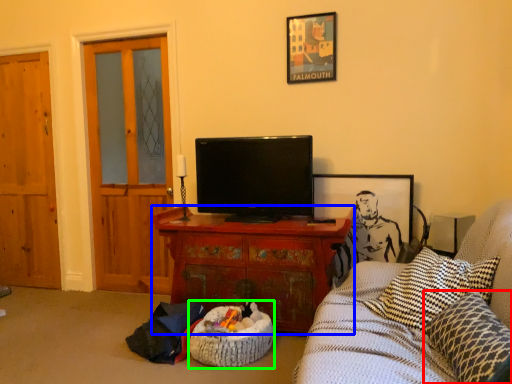
Question: Based on their relative distances, which object is nearer to pillow (highlighted by a red box)? Choose from cabinetry (highlighted by a blue box) and infant bed (highlighted by a green box).

Choices:
 (A) cabinetry
 (B) infant bed

Answer: (B)